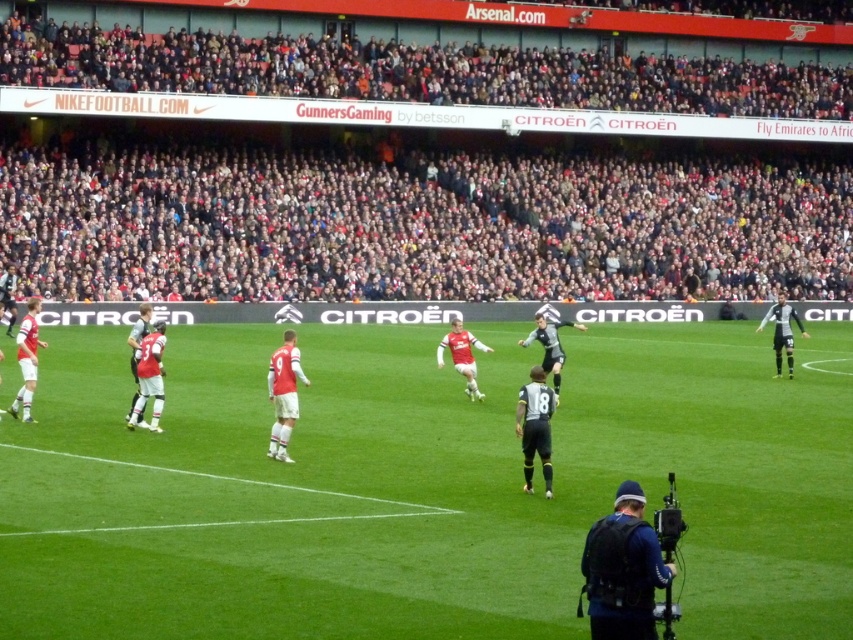
In the scene shown: You are a photographer at the stadium and want to take a photo of the black uniform at lower right. The camera you are using has a rectangular viewfinder with a 0.5x0.5 aspect ratio. The current focus point is at point (624, 570). Will the black uniform at lower right be fully visible in the viewfinder?

The point (624, 570) is on the black uniform at lower right. Since the viewfinder has a 0.5x0.5 aspect ratio, the black uniform at lower right will be fully visible in the viewfinder as long as the entire area of the black uniform fits within the viewfinder dimensions.

You are a photographer positioned at the center of the field. You need to capture a close shot of the black uniform at lower right. Based on its coordinates, in which direction should you move to get a better angle?

Result: The black uniform at lower right is located at point (624, 570), which means it is positioned towards the lower right side of the image. To get a better angle, you should move towards the lower right direction to align your camera closer to the subject.